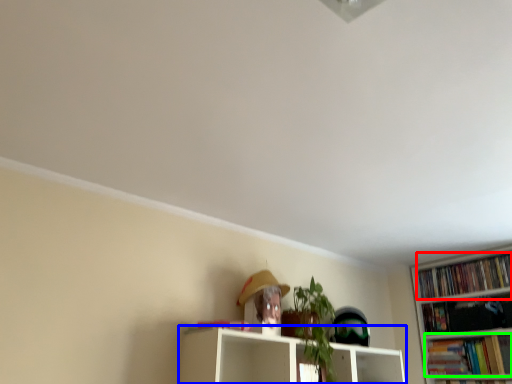
Question: Estimate the real-world distances between objects in this image. Which object is farther from book (highlighted by a red box), shelf (highlighted by a blue box) or book (highlighted by a green box)?

Choices:
 (A) shelf
 (B) book

Answer: (A)